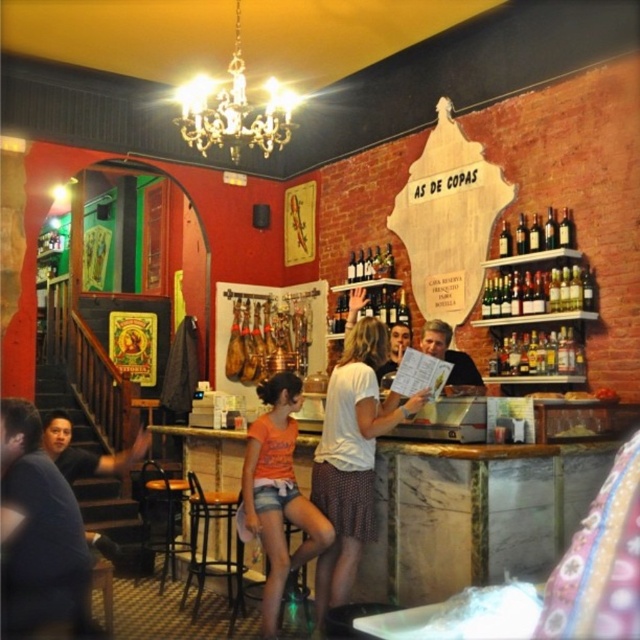
What are the coordinates of the shiny gold chandelier at upper center in the image?

The shiny gold chandelier at upper center is located at coordinates point (234,109).

You are a customer at the AS DE COPAS bar and want to take a photo of the shiny gold chandelier at upper center and the dark brown glass bottles at upper right. From your current position at the entrance, which object should you move towards to get both in the frame?

The shiny gold chandelier at upper center is positioned on the left side of dark brown glass bottles at upper right. To capture both in the frame, you should move towards the dark brown glass bottles at upper right since the chandelier is to their left, allowing both objects to be included in the photo.

You are a customer at the AS DE COPAS bar. You want to sit down at the wooden bar stool at center. Is the point at coordinate (209, 548) the location of this stool?

Yes, the point at coordinate (209, 548) is located on the wooden bar stool at center, so it is the correct location.